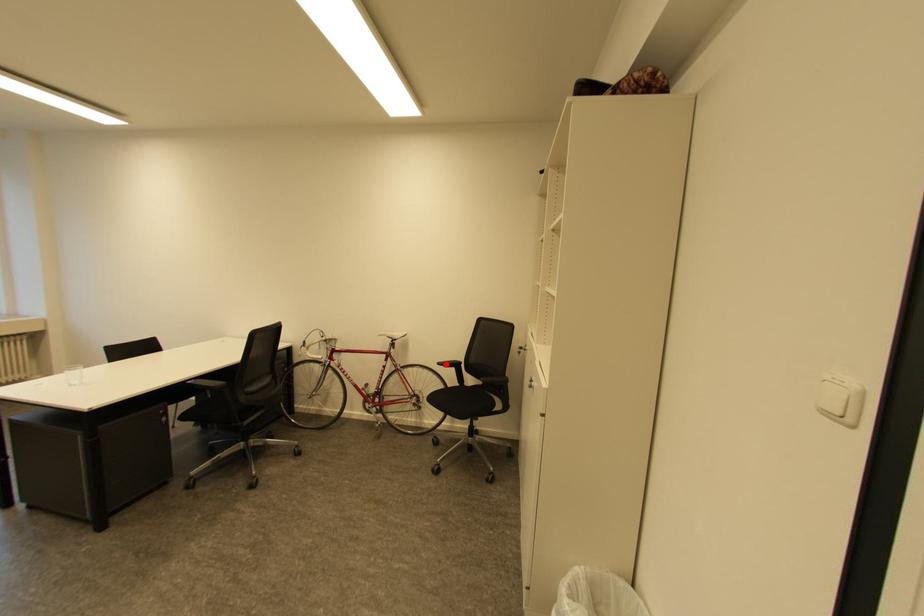
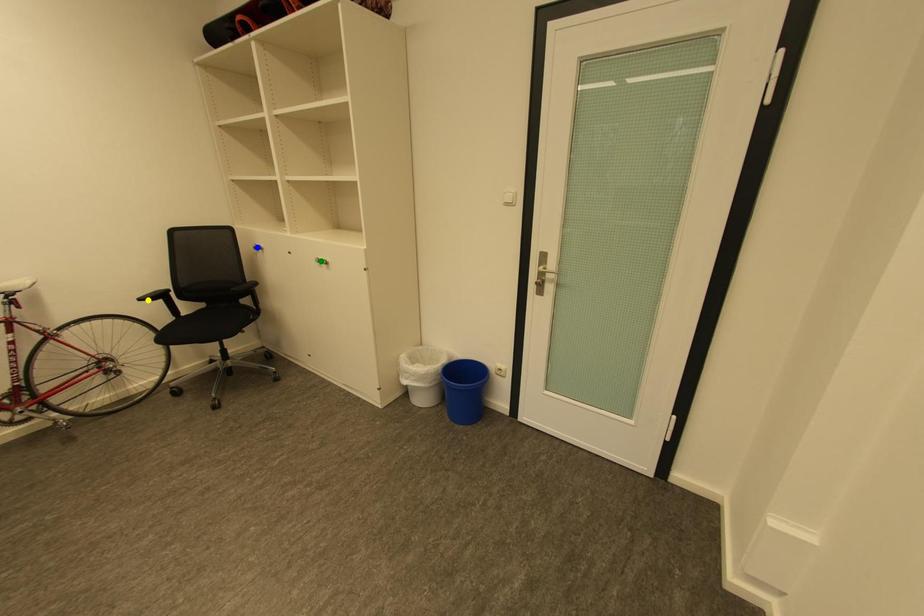
Question: I am providing you with two images of the same scene from different viewpoints. A red point is marked on the first image. You are given multiple points on the second image. Which mark in image 2 goes with the point in image 1?

Choices:
 (A) yellow point
 (B) blue point
 (C) green point

Answer: (A)